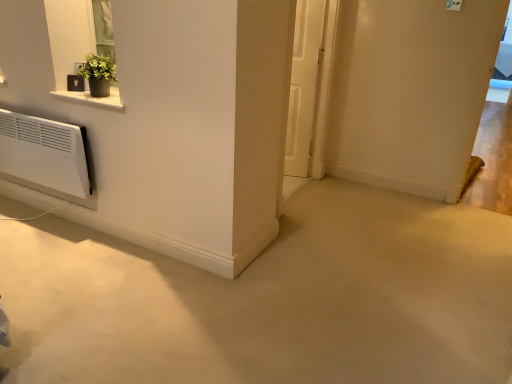
Question: Is green matte plant at upper left a part of white matte door at center?

Choices:
 (A) no
 (B) yes

Answer: (A)

Question: Considering the relative sizes of white matte door at center and green matte plant at upper left in the image provided, is white matte door at center wider than green matte plant at upper left?

Choices:
 (A) no
 (B) yes

Answer: (A)

Question: Is white matte door at center shorter than green matte plant at upper left?

Choices:
 (A) no
 (B) yes

Answer: (A)

Question: Does white matte door at center have a larger size compared to green matte plant at upper left?

Choices:
 (A) yes
 (B) no

Answer: (A)

Question: Is white matte door at center taller than green matte plant at upper left?

Choices:
 (A) no
 (B) yes

Answer: (B)

Question: Can you confirm if white matte door at center is positioned to the left of green matte plant at upper left?

Choices:
 (A) no
 (B) yes

Answer: (A)

Question: Would you say green matte plant at upper left is a long distance from white matte door at center?

Choices:
 (A) yes
 (B) no

Answer: (A)

Question: Considering the relative sizes of green matte plant at upper left and white matte door at center in the image provided, is green matte plant at upper left shorter than white matte door at center?

Choices:
 (A) no
 (B) yes

Answer: (B)

Question: Is green matte plant at upper left oriented towards white matte door at center?

Choices:
 (A) yes
 (B) no

Answer: (B)

Question: From the image's perspective, is green matte plant at upper left located above white matte door at center?

Choices:
 (A) yes
 (B) no

Answer: (B)

Question: Can you confirm if green matte plant at upper left is taller than white matte door at center?

Choices:
 (A) no
 (B) yes

Answer: (A)

Question: Considering the relative sizes of green matte plant at upper left and white matte door at center in the image provided, is green matte plant at upper left thinner than white matte door at center?

Choices:
 (A) no
 (B) yes

Answer: (A)

Question: Based on their sizes in the image, would you say green matte plant at upper left is bigger or smaller than white matte door at center?

Choices:
 (A) big
 (B) small

Answer: (B)